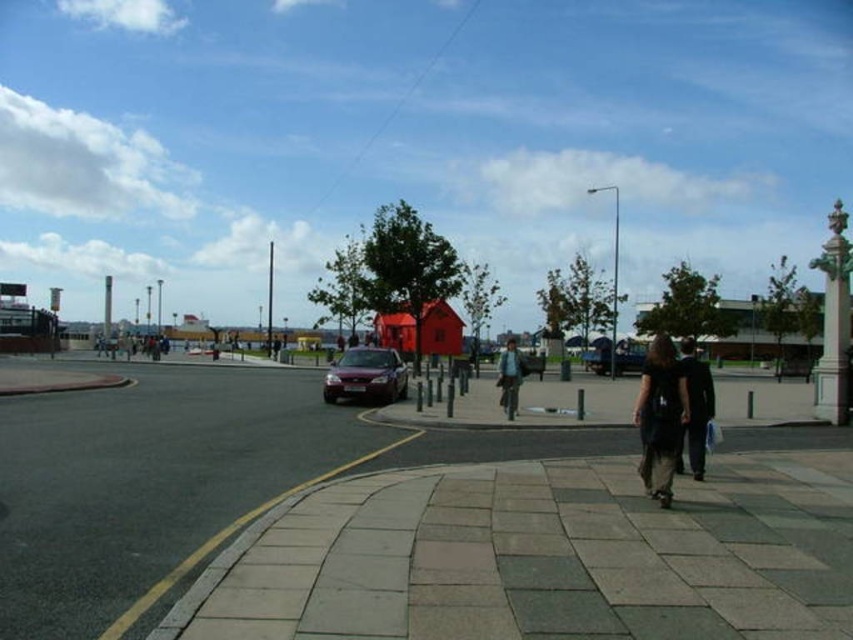
Question: Which point is farther to the camera?

Choices:
 (A) (263, 440)
 (B) (668, 369)
 (C) (358, 360)
 (D) (103, 340)

Answer: (D)

Question: Can you confirm if paved stone sidewalk at center is smaller than dark blue jacket at center?

Choices:
 (A) no
 (B) yes

Answer: (B)

Question: Which object is positioned farthest from the dark gray suit at lower right?

Choices:
 (A) dark blue jacket at center
 (B) maroon metallic car at center
 (C) paved stone sidewalk at center
 (D) dark gray fabric jacket at lower right

Answer: (A)

Question: Which object appears farthest from the camera in this image?

Choices:
 (A) maroon metallic car at center
 (B) paved stone sidewalk at center
 (C) dark gray fabric jacket at lower right

Answer: (A)

Question: Considering the relative positions of maroon metallic car at center and light brown leather jacket at center in the image provided, where is maroon metallic car at center located with respect to light brown leather jacket at center?

Choices:
 (A) below
 (B) above

Answer: (B)

Question: Is paved stone sidewalk at center bigger than dark gray fabric jacket at lower right?

Choices:
 (A) no
 (B) yes

Answer: (B)